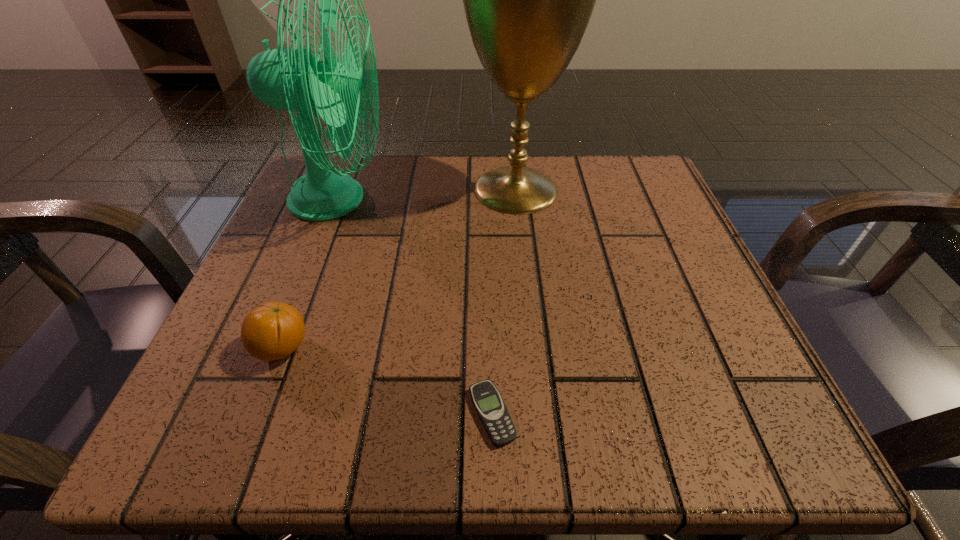
This screenshot has width=960, height=540. In the image, there is a desktop. What are the coordinates of `vacant space at the far left corner` in the screenshot? It's located at (366, 214).

You are a GUI agent. You are given a task and a screenshot of the screen. Output one action in this format:
    pyautogui.click(x=<x>, y=<y>)
    Task: Click on the vacant space at the near left corner of the desktop
    The width and height of the screenshot is (960, 540).
    Given the screenshot: What is the action you would take?
    pyautogui.click(x=179, y=418)

At what (x,y) coordinates should I click in order to perform the action: click on free space at the far right corner of the desktop. Please return your answer as a coordinate pair (x, y). Looking at the image, I should click on (667, 195).

In the image, there is a desktop. Identify the location of vacant space at the near right corner. This screenshot has height=540, width=960. (691, 408).

The height and width of the screenshot is (540, 960). Identify the location of free point between the fan and the shortest object. (415, 307).

Where is `free point between the trophy cup and the fan`? Image resolution: width=960 pixels, height=540 pixels. free point between the trophy cup and the fan is located at coordinates (427, 194).

You are a GUI agent. You are given a task and a screenshot of the screen. Output one action in this format:
    pyautogui.click(x=<x>, y=<y>)
    Task: Click on the vacant point located between the second nearest object and the fan
    The width and height of the screenshot is (960, 540).
    Given the screenshot: What is the action you would take?
    pyautogui.click(x=310, y=274)

Locate an element on the screen. Image resolution: width=960 pixels, height=540 pixels. blank region between the shortest object and the trophy cup is located at coordinates (504, 302).

Identify the location of free spot between the trophy cup and the fan. (427, 194).

The height and width of the screenshot is (540, 960). What are the coordinates of `empty location between the shortest object and the third tallest object` in the screenshot? It's located at (387, 381).